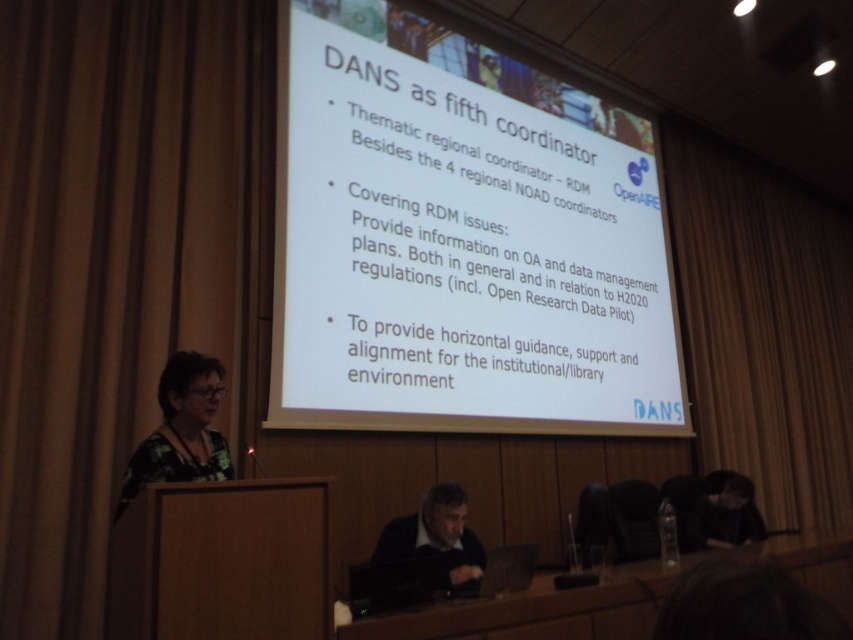
Question: Is brown fabric curtain at left wider than wooden at right?

Choices:
 (A) no
 (B) yes

Answer: (A)

Question: Estimate the real-world distances between objects in this image. Which object is closer to the brown fabric curtain at left?

Choices:
 (A) dark gray sweater at center
 (B) wooden table at lower center
 (C) wooden at right

Answer: (A)

Question: In this image, where is white paper at center located relative to printed floral blouse at left?

Choices:
 (A) left
 (B) right

Answer: (B)

Question: Which of the following is the closest to the observer?

Choices:
 (A) (10, 132)
 (B) (833, 548)
 (C) (370, 250)

Answer: (A)

Question: Which of the following is the farthest from the observer?

Choices:
 (A) (438, 534)
 (B) (708, 496)

Answer: (B)

Question: Can you confirm if wooden table at lower center is wider than black fabric at lower right?

Choices:
 (A) no
 (B) yes

Answer: (B)